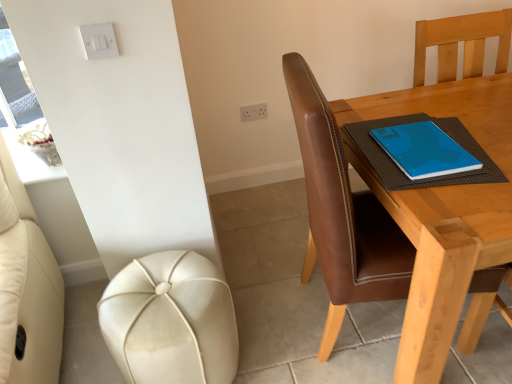
Question: Is leather-like cream stool at lower left bigger than white plastic light switch at upper left?

Choices:
 (A) no
 (B) yes

Answer: (B)

Question: From a real-world perspective, is leather-like cream stool at lower left physically below white plastic light switch at upper left?

Choices:
 (A) no
 (B) yes

Answer: (B)

Question: Does leather-like cream stool at lower left appear on the left side of white plastic light switch at upper left?

Choices:
 (A) no
 (B) yes

Answer: (A)

Question: Is white plastic light switch at upper left at the back of leather-like cream stool at lower left?

Choices:
 (A) yes
 (B) no

Answer: (B)

Question: Can white plastic light switch at upper left be found inside leather-like cream stool at lower left?

Choices:
 (A) no
 (B) yes

Answer: (A)

Question: Is point (403, 153) positioned closer to the camera than point (97, 34)?

Choices:
 (A) closer
 (B) farther

Answer: (B)

Question: In the image, is blue matte notebook at upper right on the left side or the right side of white plastic light switch at upper left?

Choices:
 (A) left
 (B) right

Answer: (B)

Question: From a real-world perspective, is blue matte notebook at upper right above or below white plastic light switch at upper left?

Choices:
 (A) above
 (B) below

Answer: (B)

Question: Based on their sizes in the image, would you say blue matte notebook at upper right is bigger or smaller than white plastic light switch at upper left?

Choices:
 (A) big
 (B) small

Answer: (A)

Question: From a real-world perspective, is blue matte notebook at upper right above or below white plastic socket at upper center?

Choices:
 (A) above
 (B) below

Answer: (A)

Question: In terms of size, does blue matte notebook at upper right appear bigger or smaller than white plastic socket at upper center?

Choices:
 (A) big
 (B) small

Answer: (A)

Question: In terms of height, does blue matte notebook at upper right look taller or shorter compared to white plastic socket at upper center?

Choices:
 (A) tall
 (B) short

Answer: (B)

Question: Would you say blue matte notebook at upper right is inside or outside white plastic socket at upper center?

Choices:
 (A) inside
 (B) outside

Answer: (B)

Question: From a real-world perspective, is blue matte notebook at upper right above or below brown leather chair at right?

Choices:
 (A) above
 (B) below

Answer: (A)

Question: Is blue matte notebook at upper right bigger or smaller than brown leather chair at right?

Choices:
 (A) small
 (B) big

Answer: (A)